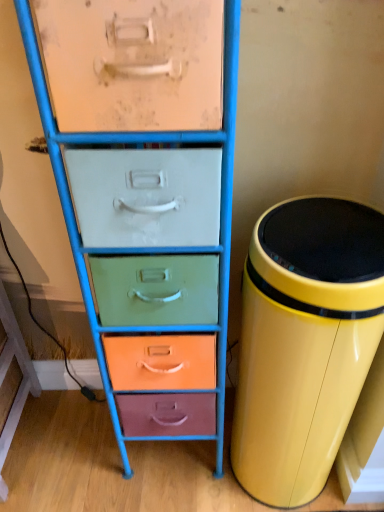
Question: From the image's perspective, is metallic drawer unit at center above or below yellow glossy trash can at right?

Choices:
 (A) above
 (B) below

Answer: (A)

Question: Considering the positions of metallic drawer unit at center and yellow glossy trash can at right in the image, is metallic drawer unit at center bigger or smaller than yellow glossy trash can at right?

Choices:
 (A) small
 (B) big

Answer: (B)

Question: From a real-world perspective, is metallic drawer unit at center physically located above or below yellow glossy trash can at right?

Choices:
 (A) above
 (B) below

Answer: (A)

Question: From the image's perspective, is yellow glossy trash can at right above or below metallic drawer unit at center?

Choices:
 (A) below
 (B) above

Answer: (A)

Question: Considering their positions, is yellow glossy trash can at right located in front of or behind metallic drawer unit at center?

Choices:
 (A) front
 (B) behind

Answer: (B)

Question: In terms of size, does yellow glossy trash can at right appear bigger or smaller than metallic drawer unit at center?

Choices:
 (A) small
 (B) big

Answer: (A)

Question: Based on their positions, is yellow glossy trash can at right located to the left or right of metallic drawer unit at center?

Choices:
 (A) right
 (B) left

Answer: (A)